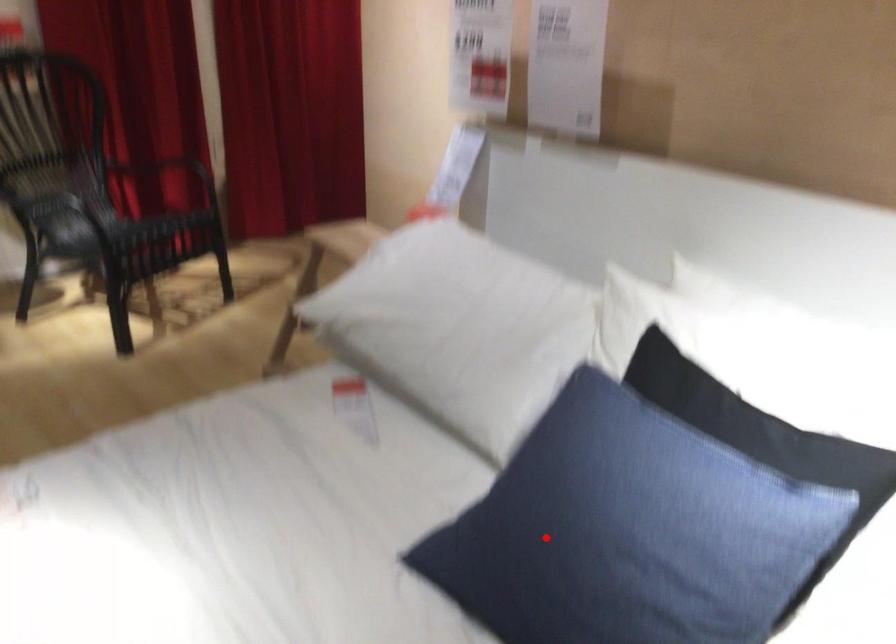
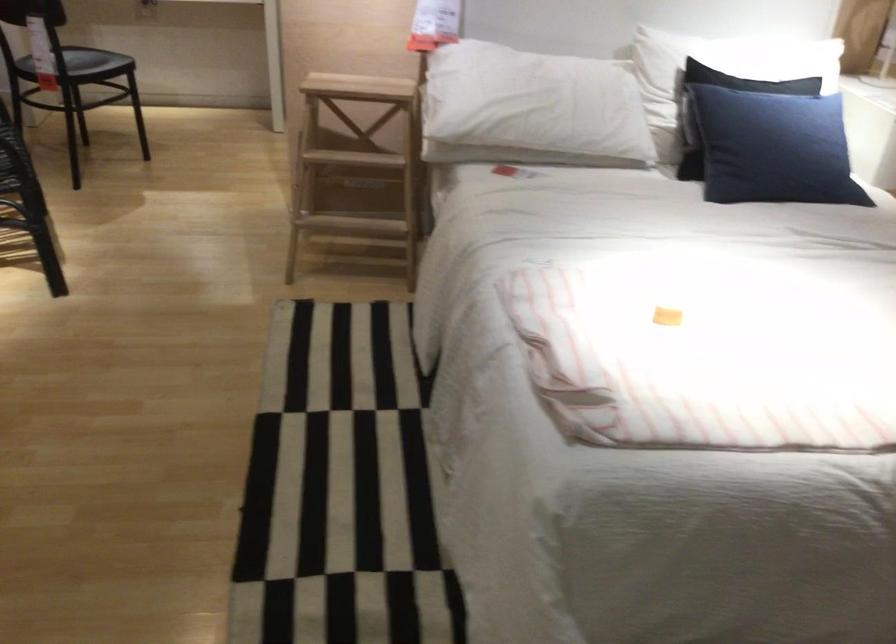
Question: A red point is marked in image1. In image2, is the corresponding 3D point closer to the camera or farther? Reply with the corresponding letter.

Choices:
 (A) The corresponding 3D point is closer.
 (B) The corresponding 3D point is farther.

Answer: (B)